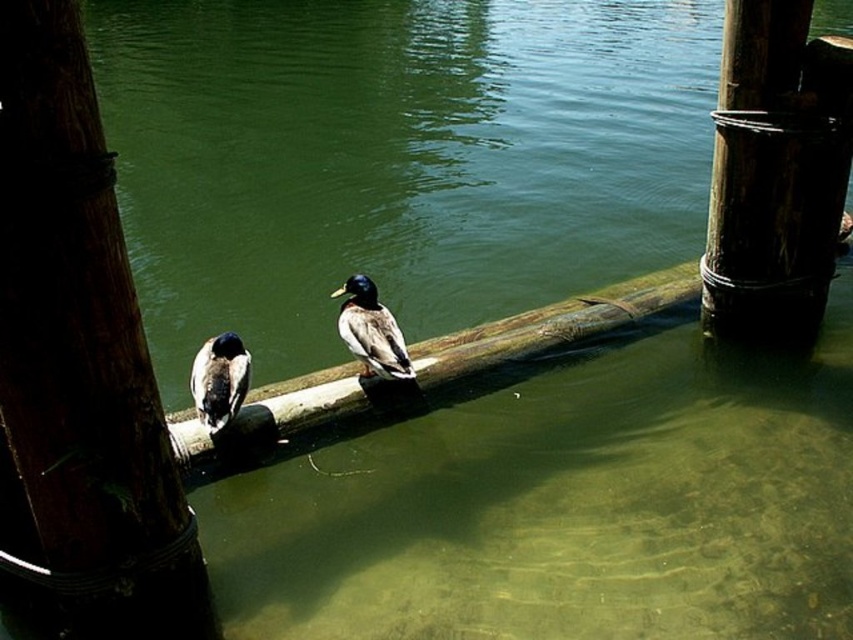
This screenshot has height=640, width=853. What do you see at coordinates (79, 364) in the screenshot? I see `dark brown wood pole at left` at bounding box center [79, 364].

Can you confirm if dark brown wood pole at left is smaller than rough wooden pole at center right?

Indeed, dark brown wood pole at left has a smaller size compared to rough wooden pole at center right.

Where is `dark brown wood pole at left`? Image resolution: width=853 pixels, height=640 pixels. dark brown wood pole at left is located at coordinates (79, 364).

Does dark brown wood pole at left have a greater width compared to greenish-brown feathers duck at center?

Yes, dark brown wood pole at left is wider than greenish-brown feathers duck at center.

Which is in front, point (32, 532) or point (397, 346)?

Point (32, 532) is in front.

I want to click on dark brown wood pole at left, so click(x=79, y=364).

Between point (350, 276) and point (222, 368), which one is positioned behind?

The point (350, 276) is more distant.

Does point (370, 301) lie behind point (212, 339)?

Yes, point (370, 301) is farther from viewer.

Identify the location of greenish-brown feathers duck at center. (370, 330).